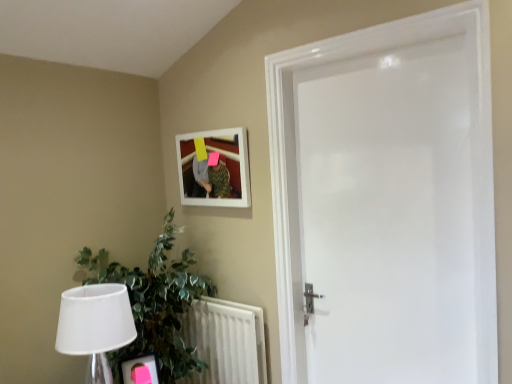
At what (x,y) coordinates should I click in order to perform the action: click on white glossy door at center. Please return your answer as a coordinate pair (x, y). Looking at the image, I should click on (386, 202).

Measure the distance between white textured radiator at lower left and camera.

They are 2.09 meters apart.

Locate an element on the screen. This screenshot has width=512, height=384. green leafy plant at lower left is located at coordinates click(154, 303).

What do you see at coordinates (95, 326) in the screenshot? I see `white fabric lampshade at lower left` at bounding box center [95, 326].

Find the location of a particular element. The image size is (512, 384). white glossy door at center is located at coordinates (386, 202).

Can you confirm if white textured radiator at lower left is thinner than white matte picture frame at upper center?

In fact, white textured radiator at lower left might be wider than white matte picture frame at upper center.

How many degrees apart are the facing directions of white textured radiator at lower left and white matte picture frame at upper center?

white textured radiator at lower left and white matte picture frame at upper center are facing 0.00255 degrees away from each other.

Between white textured radiator at lower left and white matte picture frame at upper center, which one appears on the right side from the viewer's perspective?

Positioned to the right is white textured radiator at lower left.

From a real-world perspective, relative to white matte picture frame at upper center, is white textured radiator at lower left vertically above or below?

From a real-world perspective, white textured radiator at lower left is physically below white matte picture frame at upper center.

Identify the location of radiator behind the white glossy door at center. This screenshot has height=384, width=512. (226, 341).

Which of these two, white glossy door at center or white textured radiator at lower left, is thinner?

white textured radiator at lower left is thinner.

Relative to white textured radiator at lower left, is white glossy door at center in front or behind?

In the image, white glossy door at center appears in front of white textured radiator at lower left.

From a real-world perspective, is green leafy plant at lower left physically below white fabric lampshade at lower left?

Yes, from a real-world perspective, green leafy plant at lower left is under white fabric lampshade at lower left.

Who is taller, green leafy plant at lower left or white fabric lampshade at lower left?

green leafy plant at lower left.

In the scene shown: Considering the sizes of objects green leafy plant at lower left and white fabric lampshade at lower left in the image provided, who is wider, green leafy plant at lower left or white fabric lampshade at lower left?

With larger width is green leafy plant at lower left.

Is point (177, 152) positioned in front of point (68, 297)?

That is False.

From the image's perspective, which is below, white matte picture frame at upper center or white fabric lampshade at lower left?

white fabric lampshade at lower left, from the image's perspective.

Based on the photo, which object is positioned more to the left, white matte picture frame at upper center or white fabric lampshade at lower left?

white fabric lampshade at lower left is more to the left.

Are white matte picture frame at upper center and white fabric lampshade at lower left making contact?

white matte picture frame at upper center and white fabric lampshade at lower left are not in contact.

Are white textured radiator at lower left and green leafy plant at lower left making contact?

There is a gap between white textured radiator at lower left and green leafy plant at lower left.

Is point (241, 345) closer or farther from the camera than point (88, 280)?

Point (241, 345) is positioned closer to the camera compared to point (88, 280).

Is white textured radiator at lower left looking in the opposite direction of green leafy plant at lower left?

Yes, white textured radiator at lower left is positioned with its back facing green leafy plant at lower left.

Which is more to the right, white matte picture frame at upper center or white textured radiator at lower left?

From the viewer's perspective, white textured radiator at lower left appears more on the right side.

From a real-world perspective, is white matte picture frame at upper center below white textured radiator at lower left?

No, from a real-world perspective, white matte picture frame at upper center is not under white textured radiator at lower left.

Is white textured radiator at lower left at the back of white matte picture frame at upper center?

No, white matte picture frame at upper center's orientation is not away from white textured radiator at lower left.

Locate an element on the screen. picture frame positioned vertically above the white textured radiator at lower left (from a real-world perspective) is located at coordinates (214, 168).

Locate an element on the screen. The width and height of the screenshot is (512, 384). table lamp above the white textured radiator at lower left (from the image's perspective) is located at coordinates (95, 326).

Is white textured radiator at lower left aimed at white fabric lampshade at lower left?

Yes, white textured radiator at lower left faces towards white fabric lampshade at lower left.

Can you confirm if white textured radiator at lower left is wider than white fabric lampshade at lower left?

In fact, white textured radiator at lower left might be narrower than white fabric lampshade at lower left.

The image size is (512, 384). Find the location of `picture frame above the white textured radiator at lower left (from the image's perspective)`. picture frame above the white textured radiator at lower left (from the image's perspective) is located at coordinates (214, 168).

Locate an element on the screen. The height and width of the screenshot is (384, 512). door that is on the right side of white textured radiator at lower left is located at coordinates 386,202.

Looking at the image, which one is located further to white matte picture frame at upper center, white fabric lampshade at lower left or green leafy plant at lower left?

white fabric lampshade at lower left.

Based on their spatial positions, is white fabric lampshade at lower left or white matte picture frame at upper center further from green leafy plant at lower left?

white matte picture frame at upper center lies further to green leafy plant at lower left than the other object.

Considering their positions, is white glossy door at center positioned further to white fabric lampshade at lower left than white matte picture frame at upper center?

Based on the image, white glossy door at center appears to be further to white fabric lampshade at lower left.

Looking at the image, which one is located further to white glossy door at center, green leafy plant at lower left or white textured radiator at lower left?

green leafy plant at lower left lies further to white glossy door at center than the other object.

When comparing their distances from white glossy door at center, does white textured radiator at lower left or white fabric lampshade at lower left seem further?

The object further to white glossy door at center is white fabric lampshade at lower left.

Based on their spatial positions, is green leafy plant at lower left or white fabric lampshade at lower left closer to white matte picture frame at upper center?

green leafy plant at lower left.

Considering their positions, is white matte picture frame at upper center positioned further to white fabric lampshade at lower left than white glossy door at center?

Based on the image, white glossy door at center appears to be further to white fabric lampshade at lower left.

Looking at the image, which one is located further to white matte picture frame at upper center, white fabric lampshade at lower left or white glossy door at center?

white fabric lampshade at lower left lies further to white matte picture frame at upper center than the other object.

Where is `table lamp between white matte picture frame at upper center and white textured radiator at lower left in the vertical direction`? This screenshot has height=384, width=512. table lamp between white matte picture frame at upper center and white textured radiator at lower left in the vertical direction is located at coordinates (95, 326).

This screenshot has width=512, height=384. I want to click on houseplant between white matte picture frame at upper center and white fabric lampshade at lower left from top to bottom, so click(154, 303).

This screenshot has width=512, height=384. Identify the location of picture frame between green leafy plant at lower left and white glossy door at center from left to right. (214, 168).

The width and height of the screenshot is (512, 384). Find the location of `door between white matte picture frame at upper center and white textured radiator at lower left in the vertical direction`. door between white matte picture frame at upper center and white textured radiator at lower left in the vertical direction is located at coordinates (386, 202).